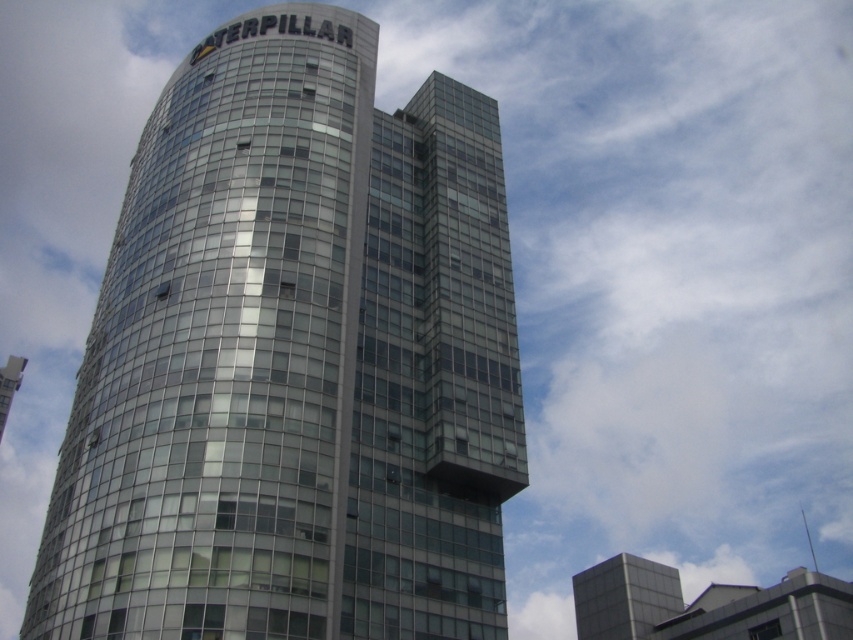
Based on the photo, which of these two, transparent glass building at center or metallic glass building at upper right, stands taller?

metallic glass building at upper right

Does transparent glass building at center come behind metallic glass building at upper right?

No, transparent glass building at center is closer to the viewer.

Which is behind, point (260, 228) or point (584, 593)?

The point (584, 593) is behind.

Find the location of a particular element. The image size is (853, 640). transparent glass building at center is located at coordinates pos(294,360).